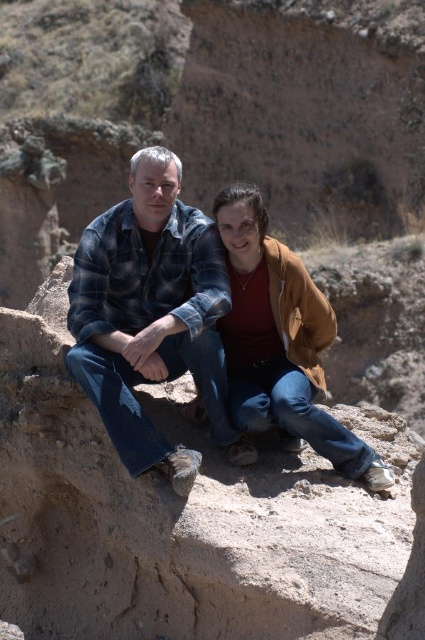
You are a photographer trying to capture the plaid flannel shirt at center in your shot. You notice that your camera is currently focused on the point at coordinates point (152, 316). Is the plaid flannel shirt at center within the focus area of your camera?

Yes, the point (152, 316) marks the plaid flannel shirt at center, so the camera is focused on it.

You are a photographer planning to take a portrait of the two people in the scene. You want to ensure that both the plaid flannel shirt at center and the brown suede jacket at center are clearly visible in the frame. Considering their sizes, which clothing item might require more careful framing to avoid being obscured?

The plaid flannel shirt at center is bigger than the brown suede jacket at center, so the plaid flacial shirt at center might require more careful framing to ensure it doesn